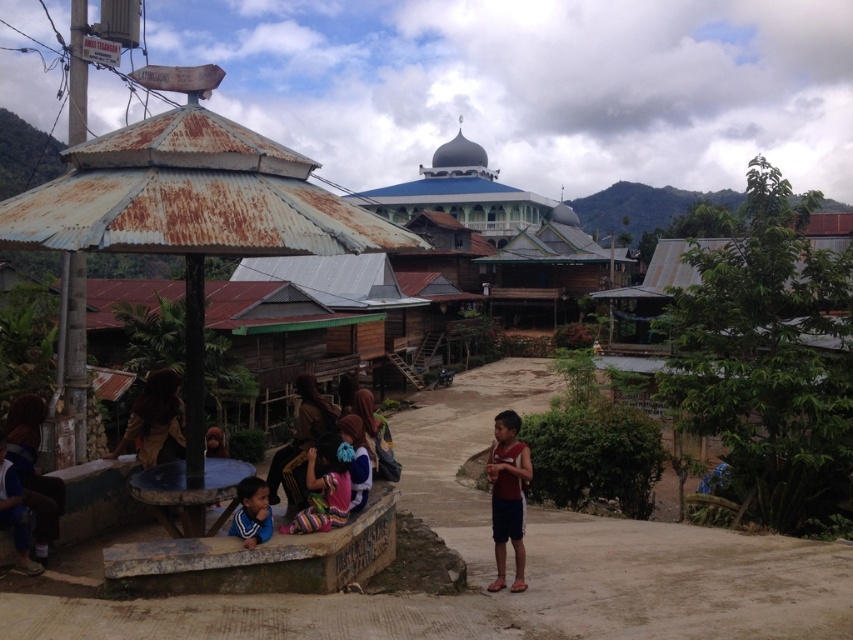
Question: Among these objects, which one is nearest to the camera?

Choices:
 (A) matte blue shirt at lower left
 (B) multicolored fabric at center

Answer: (A)

Question: Can you confirm if matte blue shirt at lower left is bigger than multicolored fabric at center?

Choices:
 (A) yes
 (B) no

Answer: (A)

Question: Does brown fabric at lower left appear under brown fabric shirt at lower left?

Choices:
 (A) yes
 (B) no

Answer: (B)

Question: Among these objects, which one is nearest to the camera?

Choices:
 (A) striped fabric dress at lower center
 (B) rusty metal hut at left
 (C) brown fabric dress at center

Answer: (B)

Question: Can you confirm if reddish-brown fabric shorts at center is positioned to the right of brown fabric shirt at lower left?

Choices:
 (A) yes
 (B) no

Answer: (A)

Question: Among these objects, which one is farthest from the camera?

Choices:
 (A) matte blue shirt at lower left
 (B) striped fabric dress at lower center
 (C) rusty metal hut at left

Answer: (B)